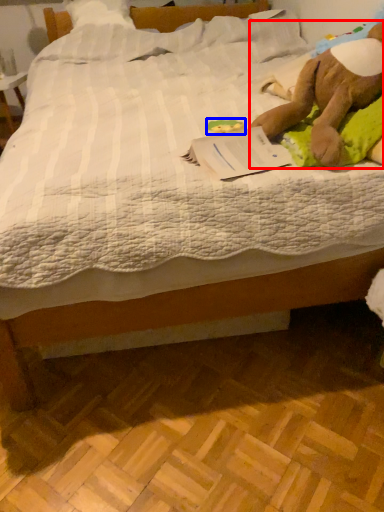
Question: Which of the following is the farthest to the observer, animal (highlighted by a red box) or toy (highlighted by a blue box)?

Choices:
 (A) animal
 (B) toy

Answer: (B)